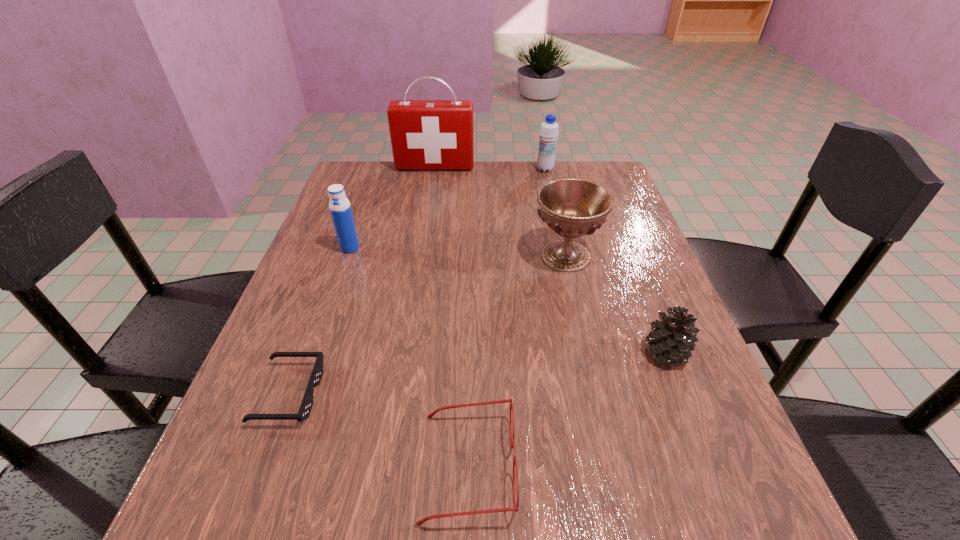
This screenshot has width=960, height=540. What are the coordinates of `sunglasses that is at the left edge` in the screenshot? It's located at (304, 411).

Locate an element on the screen. chalice that is at the right edge is located at coordinates (572, 208).

You are a GUI agent. You are given a task and a screenshot of the screen. Output one action in this format:
    pyautogui.click(x=<x>, y=<y>)
    Task: Click on the pinecone present at the right edge
    The height and width of the screenshot is (540, 960).
    Given the screenshot: What is the action you would take?
    tap(672, 339)

Where is `object located at the far left corner`? The height and width of the screenshot is (540, 960). object located at the far left corner is located at coordinates (425, 134).

In the image, there is a desktop. Where is `vacant space at the far edge`? vacant space at the far edge is located at coordinates (504, 195).

Locate an element on the screen. vacant region at the left edge of the desktop is located at coordinates (367, 268).

In the image, there is a desktop. At what (x,y) coordinates should I click in order to perform the action: click on free region at the right edge. Please return your answer as a coordinate pair (x, y). Image resolution: width=960 pixels, height=540 pixels. Looking at the image, I should click on (621, 297).

This screenshot has height=540, width=960. I want to click on free spot at the far left corner of the desktop, so click(x=368, y=179).

This screenshot has width=960, height=540. In the image, there is a desktop. What are the coordinates of `vacant space at the far right corner` in the screenshot? It's located at (609, 176).

Find the location of a particular element. Image resolution: width=960 pixels, height=540 pixels. vacant point located between the spectacles and the rightmost object is located at coordinates (566, 409).